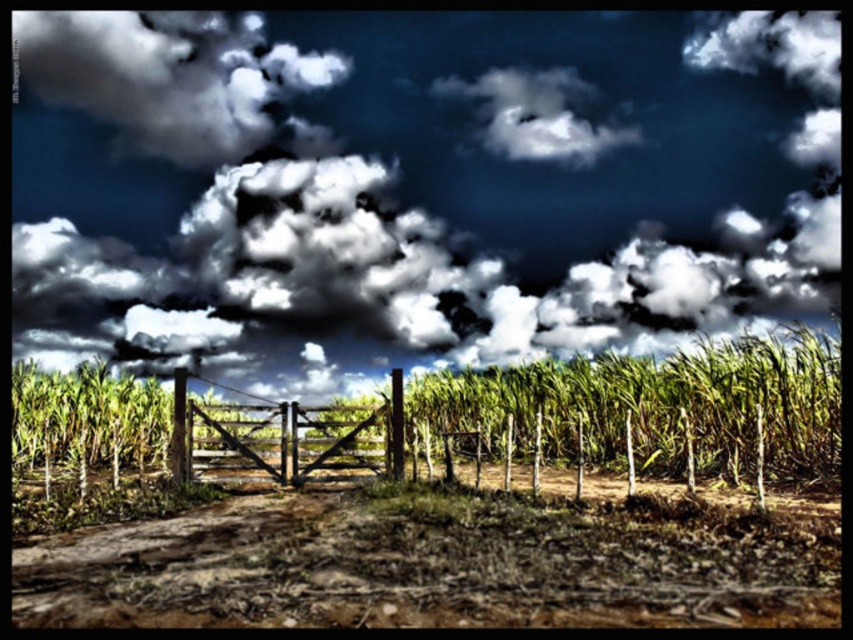
In the scene shown: You are a farmer planning to plant more crops. You notice the green grassy corn field at center and the wooden gate at center. Which area takes up more space in the image?

The wooden gate at center occupies more space than the green grassy corn field at center.

Consider the image. You are standing on the dirt path and looking towards the wooden gate. Which object, the brown soil at center or the dark gray fluffy cloud at upper left, is closer to you?

The brown soil at center is closer to you because it is taller than the dark gray fluffy cloud at upper left, indicating it occupies a lower position in the visual field.